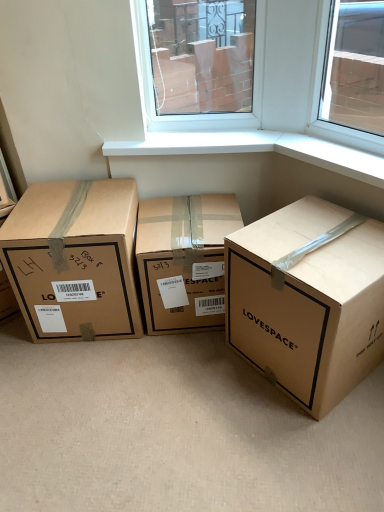
Question: Can you confirm if brown cardboard box at left, acting as the first box starting from the left, is shorter than brown cardboard box at center, which is counted as the 2th box, starting from the left?

Choices:
 (A) yes
 (B) no

Answer: (B)

Question: From the image's perspective, is brown cardboard box at left, marked as the third box in a right-to-left arrangement, below brown cardboard box at center, which is counted as the 2th box, starting from the left?

Choices:
 (A) no
 (B) yes

Answer: (A)

Question: Is brown cardboard box at left, marked as the third box in a right-to-left arrangement, bigger than brown cardboard box at center, the 2th box from the right?

Choices:
 (A) yes
 (B) no

Answer: (A)

Question: Is brown cardboard box at left, marked as the third box in a right-to-left arrangement, closer to camera compared to brown cardboard box at center, the 2th box from the right?

Choices:
 (A) no
 (B) yes

Answer: (B)

Question: Does brown cardboard box at left, marked as the third box in a right-to-left arrangement, have a greater width compared to brown cardboard box at center, which is counted as the 2th box, starting from the left?

Choices:
 (A) no
 (B) yes

Answer: (B)

Question: Is brown cardboard box at left, marked as the third box in a right-to-left arrangement, at the right side of brown cardboard box at center, which is counted as the 2th box, starting from the left?

Choices:
 (A) yes
 (B) no

Answer: (B)

Question: Is the depth of brown cardboard box at left, acting as the first box starting from the left, greater than that of brown cardboard box at center, acting as the first box starting from the right?

Choices:
 (A) no
 (B) yes

Answer: (B)

Question: Is brown cardboard box at left, acting as the first box starting from the left, positioned with its back to brown cardboard box at center, which is the third box in left-to-right order?

Choices:
 (A) yes
 (B) no

Answer: (B)

Question: Considering the relative sizes of brown cardboard box at left, marked as the third box in a right-to-left arrangement, and brown cardboard box at center, which is the third box in left-to-right order, in the image provided, is brown cardboard box at left, marked as the third box in a right-to-left arrangement, taller than brown cardboard box at center, which is the third box in left-to-right order,?

Choices:
 (A) no
 (B) yes

Answer: (B)

Question: From the image's perspective, is brown cardboard box at left, acting as the first box starting from the left, beneath brown cardboard box at center, which is the third box in left-to-right order?

Choices:
 (A) yes
 (B) no

Answer: (B)

Question: Does brown cardboard box at left, marked as the third box in a right-to-left arrangement, have a greater width compared to brown cardboard box at center, acting as the first box starting from the right?

Choices:
 (A) no
 (B) yes

Answer: (A)

Question: Can you confirm if brown cardboard box at left, acting as the first box starting from the left, is thinner than brown cardboard box at center, which is the third box in left-to-right order?

Choices:
 (A) no
 (B) yes

Answer: (B)

Question: From the image's perspective, is brown cardboard box at center, acting as the first box starting from the right, above brown cardboard box at center, the 2th box from the right?

Choices:
 (A) no
 (B) yes

Answer: (A)